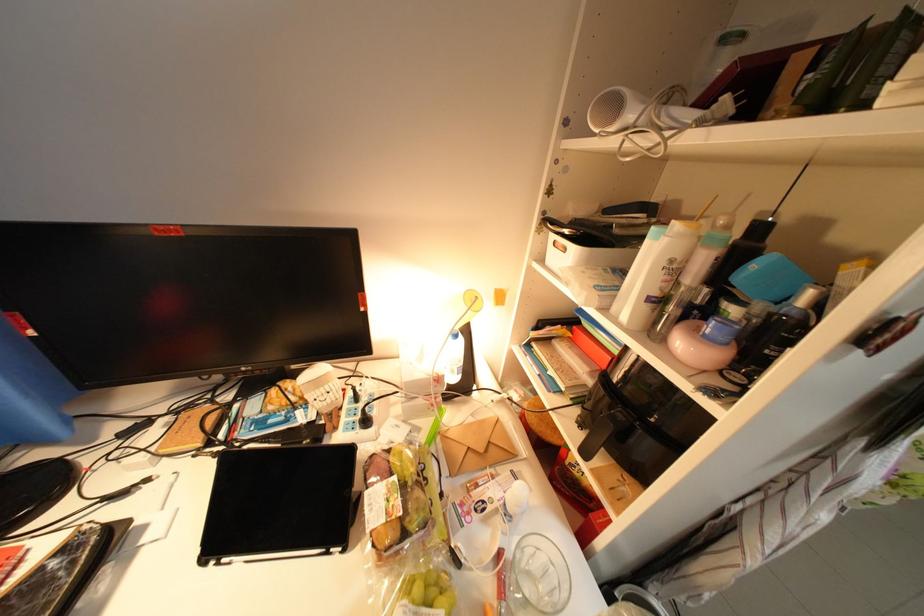
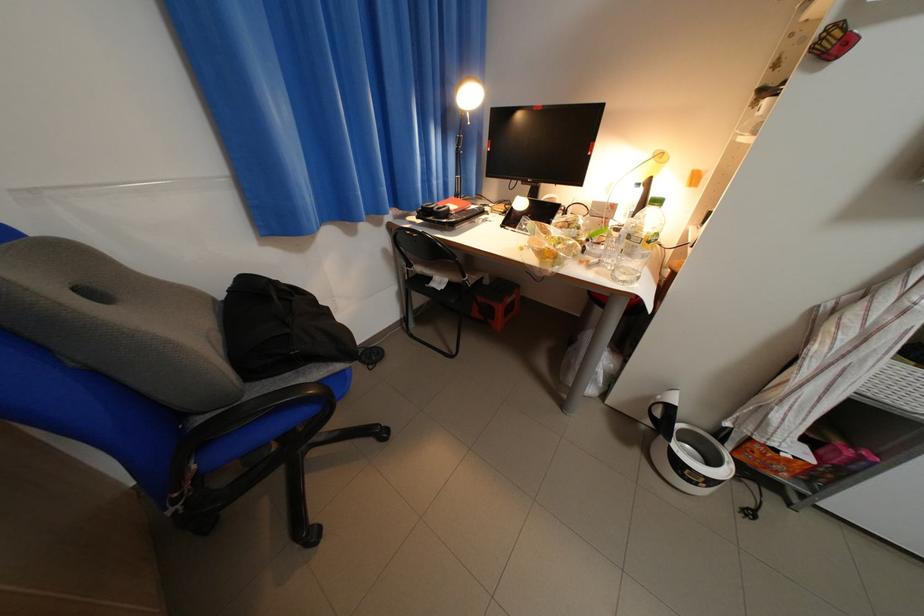
Question: Based on the continuous images, in which direction is the camera rotating? Reply with the corresponding letter.

Choices:
 (A) Left
 (B) Right
 (C) Up
 (D) Down

Answer: (A)